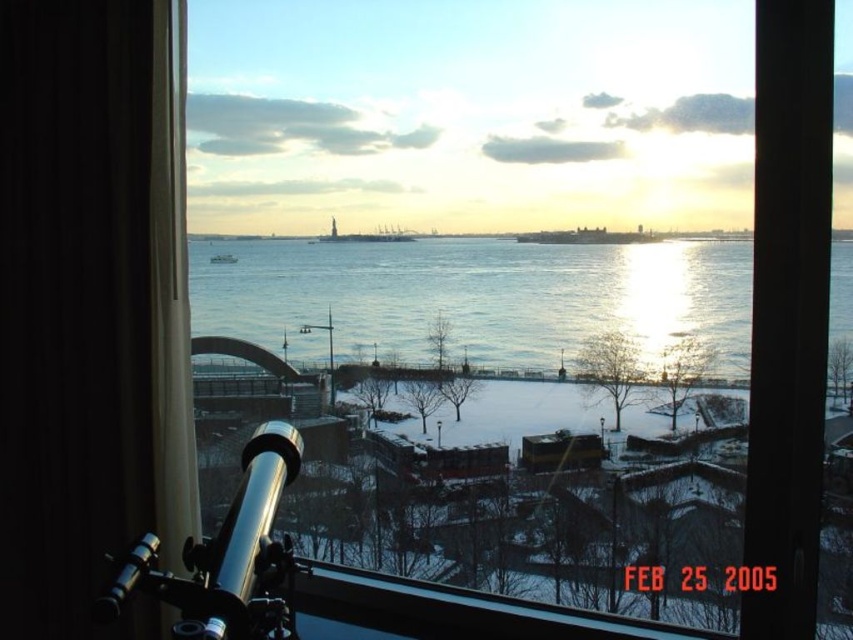
Does clear blue water at center have a greater height compared to polished silver telescope at lower left?

No.

What are the coordinates of `clear blue water at center` in the screenshot? It's located at (476, 296).

Is point (730, 355) farther from camera compared to point (252, 486)?

Yes.

Where is `clear blue water at center`? clear blue water at center is located at coordinates (476, 296).

The image size is (853, 640). What do you see at coordinates (476, 296) in the screenshot?
I see `clear blue water at center` at bounding box center [476, 296].

Who is more forward, (x=572, y=289) or (x=219, y=257)?

Point (x=572, y=289) is in front.

Find the location of `clear blue water at center`. clear blue water at center is located at coordinates (476, 296).

Does polished silver telescope at lower left have a lesser height compared to white plastic boat at center?

In fact, polished silver telescope at lower left may be taller than white plastic boat at center.

Can you confirm if polished silver telescope at lower left is smaller than white plastic boat at center?

No, polished silver telescope at lower left is not smaller than white plastic boat at center.

Between point (250, 620) and point (218, 262), which one is positioned in front?

Point (250, 620)

You are a GUI agent. You are given a task and a screenshot of the screen. Output one action in this format:
    pyautogui.click(x=<x>, y=<y>)
    Task: Click on the polished silver telescope at lower left
    The height and width of the screenshot is (640, 853).
    Given the screenshot: What is the action you would take?
    pyautogui.click(x=225, y=556)